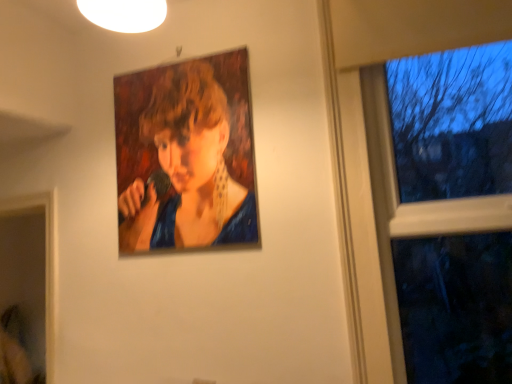
Question: Visually, is oil painting portrait at upper center positioned to the left or to the right of transparent glass window at right?

Choices:
 (A) right
 (B) left

Answer: (B)

Question: In the image, is oil painting portrait at upper center positioned in front of or behind transparent glass window at right?

Choices:
 (A) behind
 (B) front

Answer: (A)

Question: Is point (179, 79) closer or farther from the camera than point (419, 96)?

Choices:
 (A) closer
 (B) farther

Answer: (B)

Question: Considering the positions of transparent glass window at right and oil painting portrait at upper center in the image, is transparent glass window at right bigger or smaller than oil painting portrait at upper center?

Choices:
 (A) small
 (B) big

Answer: (B)

Question: From the image's perspective, is transparent glass window at right positioned above or below oil painting portrait at upper center?

Choices:
 (A) below
 (B) above

Answer: (A)

Question: Considering the positions of transparent glass window at right and oil painting portrait at upper center in the image, is transparent glass window at right taller or shorter than oil painting portrait at upper center?

Choices:
 (A) short
 (B) tall

Answer: (B)

Question: Considering their positions, is transparent glass window at right located in front of or behind oil painting portrait at upper center?

Choices:
 (A) behind
 (B) front

Answer: (B)